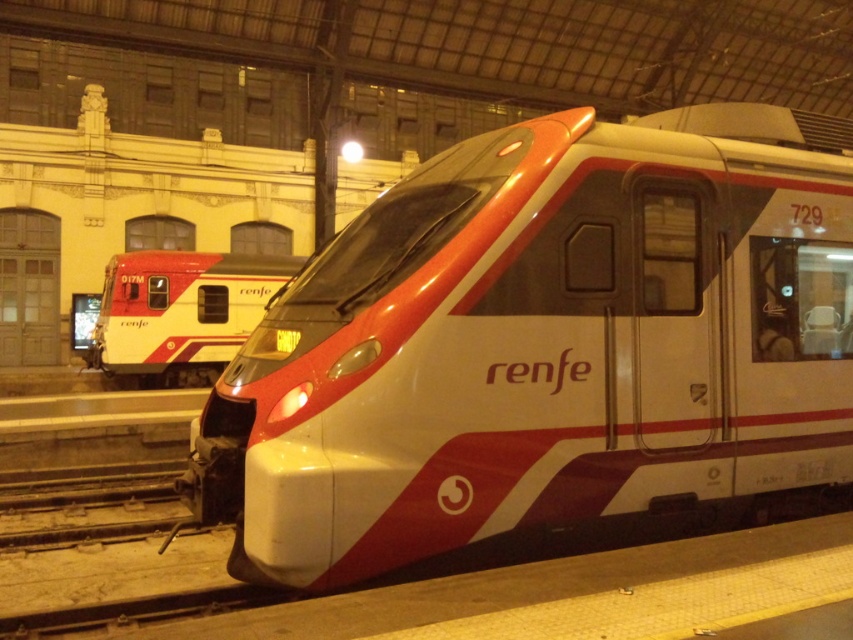
Is matte white train at center shorter than matte white train at left?

Yes, matte white train at center is shorter than matte white train at left.

Is point (511, 452) in front of point (257, 272)?

Yes, it is in front of point (257, 272).

Which is behind, point (497, 166) or point (155, 282)?

The point (155, 282) is behind.

Where is `matte white train at center`? The width and height of the screenshot is (853, 640). matte white train at center is located at coordinates (544, 344).